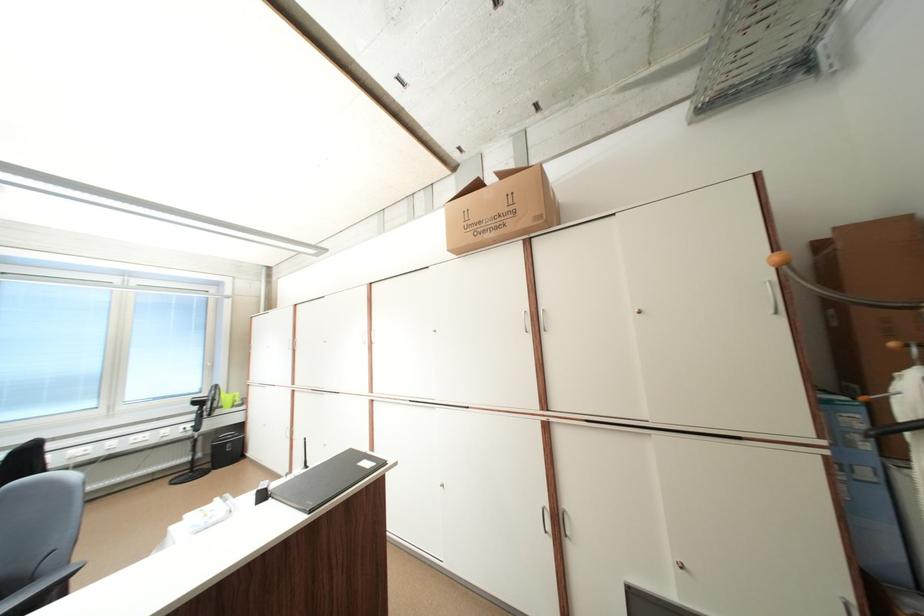
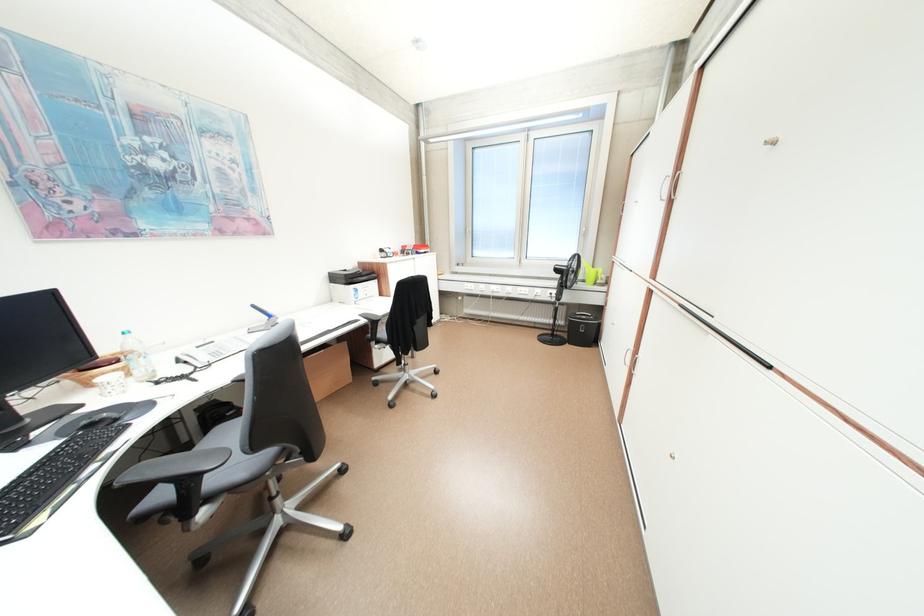
Locate, in the second image, the point that corresponds to (237,398) in the first image.

(598, 273)